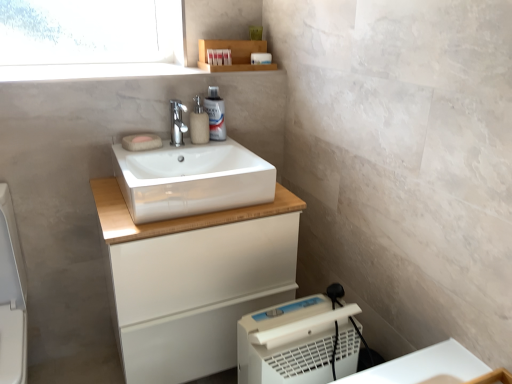
Question: Is wooden shelf at upper center oriented towards white glossy lotion at upper center, placed as the first toiletry when sorted from bottom to top?

Choices:
 (A) no
 (B) yes

Answer: (A)

Question: Can you confirm if wooden shelf at upper center is thinner than white glossy lotion at upper center, which appears as the fourth toiletry when viewed from the top?

Choices:
 (A) no
 (B) yes

Answer: (A)

Question: From a real-world perspective, is wooden shelf at upper center on white glossy lotion at upper center, placed as the first toiletry when sorted from bottom to top?

Choices:
 (A) no
 (B) yes

Answer: (B)

Question: Is wooden shelf at upper center outside white glossy lotion at upper center, which appears as the fourth toiletry when viewed from the top?

Choices:
 (A) yes
 (B) no

Answer: (A)

Question: Are wooden shelf at upper center and white glossy lotion at upper center, placed as the first toiletry when sorted from bottom to top, located far from each other?

Choices:
 (A) yes
 (B) no

Answer: (B)

Question: From the image's perspective, would you say wooden shelf at upper center is shown under white glossy lotion at upper center, which appears as the fourth toiletry when viewed from the top?

Choices:
 (A) yes
 (B) no

Answer: (B)

Question: Can you confirm if white glossy sink at center is bigger than beige fabric soap at upper center, which is the first soap from front to back?

Choices:
 (A) no
 (B) yes

Answer: (B)

Question: From a real-world perspective, is white glossy sink at center physically below beige fabric soap at upper center, arranged as the second soap when viewed from the back?

Choices:
 (A) yes
 (B) no

Answer: (A)

Question: Is white glossy sink at center smaller than beige fabric soap at upper center, which is the first soap from front to back?

Choices:
 (A) no
 (B) yes

Answer: (A)

Question: From a real-world perspective, is white glossy sink at center on top of beige fabric soap at upper center, which is the first soap from front to back?

Choices:
 (A) yes
 (B) no

Answer: (B)

Question: Is white glossy sink at center positioned before beige fabric soap at upper center, which is the first soap from front to back?

Choices:
 (A) no
 (B) yes

Answer: (B)

Question: Is white glossy sink at center next to beige fabric soap at upper center, arranged as the second soap when viewed from the back, and touching it?

Choices:
 (A) yes
 (B) no

Answer: (B)

Question: Can you confirm if white plastic container at upper center, which appears as the 1th toiletry when viewed from the top, is taller than matte plastic container at upper center, the second toiletry in the bottom-to-top sequence?

Choices:
 (A) no
 (B) yes

Answer: (A)